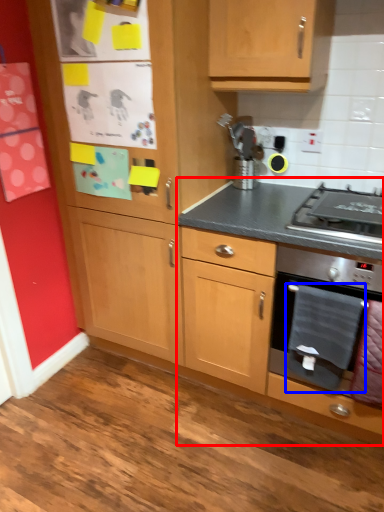
Question: Which object appears farthest to the camera in this image, cabinetry (highlighted by a red box) or blanket (highlighted by a blue box)?

Choices:
 (A) cabinetry
 (B) blanket

Answer: (B)